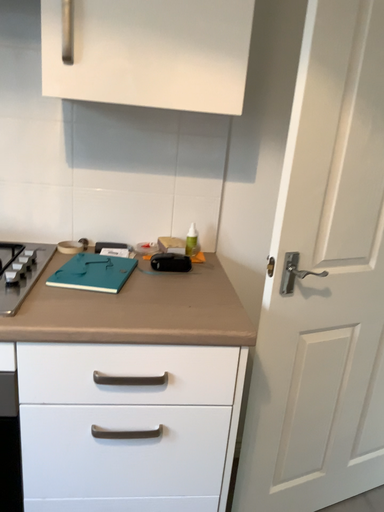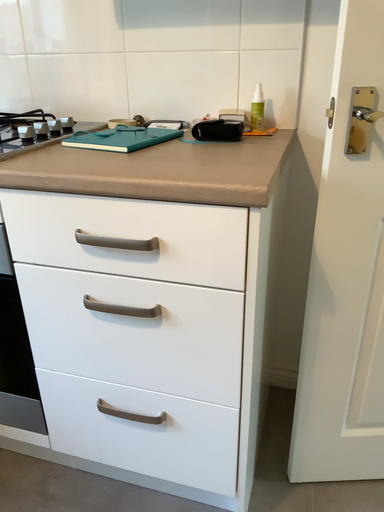
Question: Which way did the camera rotate in the video?

Choices:
 (A) rotated left
 (B) rotated right

Answer: (A)